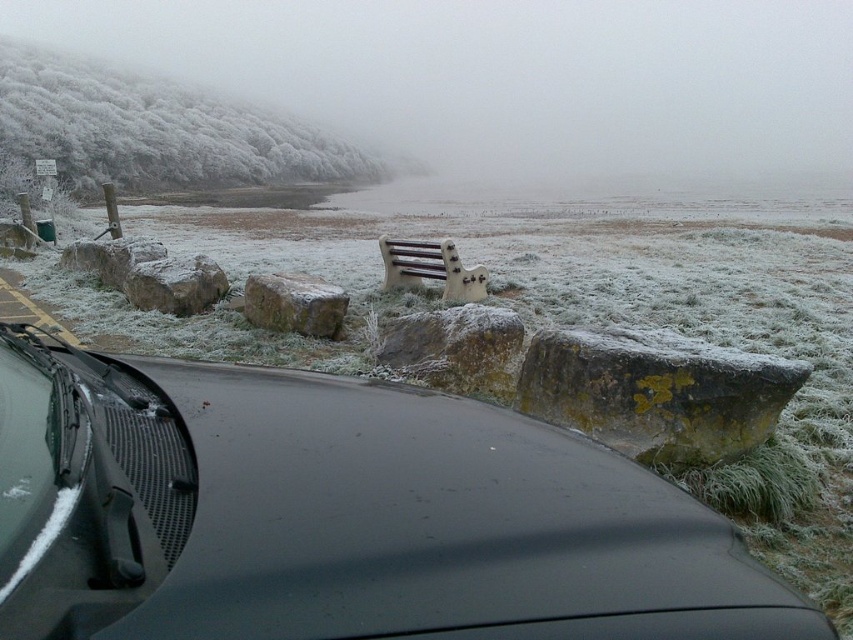
Is glossy black car at lower center to the right of clear glass windshield at lower left from the viewer's perspective?

Indeed, glossy black car at lower center is positioned on the right side of clear glass windshield at lower left.

Is glossy black car at lower center taller than clear glass windshield at lower left?

Indeed, glossy black car at lower center has a greater height compared to clear glass windshield at lower left.

Who is more distant from viewer, (x=6, y=600) or (x=115, y=371)?

The point (x=115, y=371) is behind.

At what (x,y) coordinates should I click in order to perform the action: click on glossy black car at lower center. Please return your answer as a coordinate pair (x, y). This screenshot has width=853, height=640. Looking at the image, I should click on (339, 515).

Does sandy brown rock at left have a greater width compared to white painted wood bench at center?

No, sandy brown rock at left is not wider than white painted wood bench at center.

Is the position of sandy brown rock at left less distant than that of white painted wood bench at center?

Yes, sandy brown rock at left is closer to the viewer.

Does point (181, 308) come closer to viewer compared to point (396, 285)?

Yes, it is in front of point (396, 285).

I want to click on sandy brown rock at left, so click(x=175, y=284).

Can you confirm if glossy black car at lower center is positioned above sandy brown rock at center?

Actually, glossy black car at lower center is below sandy brown rock at center.

Does glossy black car at lower center lie behind sandy brown rock at center?

No.

Describe the element at coordinates (339, 515) in the screenshot. The image size is (853, 640). I see `glossy black car at lower center` at that location.

Identify the location of glossy black car at lower center. (339, 515).